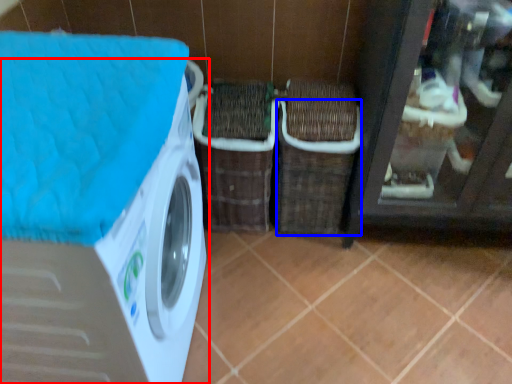
Question: Among these objects, which one is nearest to the camera, washing machine (highlighted by a red box) or basket (highlighted by a blue box)?

Choices:
 (A) washing machine
 (B) basket

Answer: (A)